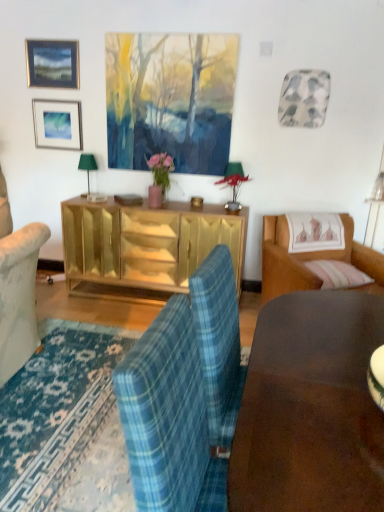
Find the location of a particular element. Image resolution: width=384 pixels, height=512 pixels. vacant area that is situated to the right of green fabric lampshade at left is located at coordinates (107, 197).